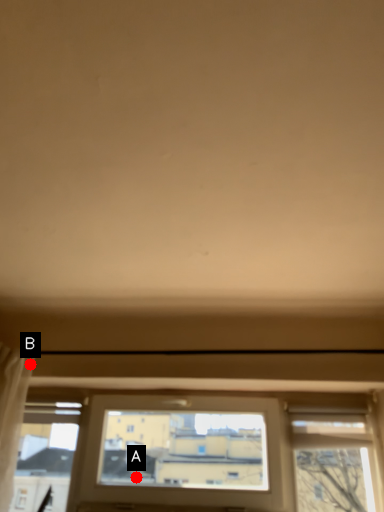
Question: Two points are circled on the image, labeled by A and B beside each circle. Which point is farther from the camera taking this photo?

Choices:
 (A) A is further
 (B) B is further

Answer: (A)